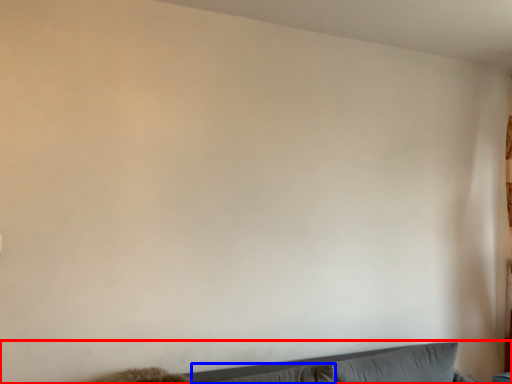
Question: Among these objects, which one is nearest to the camera, couch (highlighted by a red box) or pillow (highlighted by a blue box)?

Choices:
 (A) couch
 (B) pillow

Answer: (A)